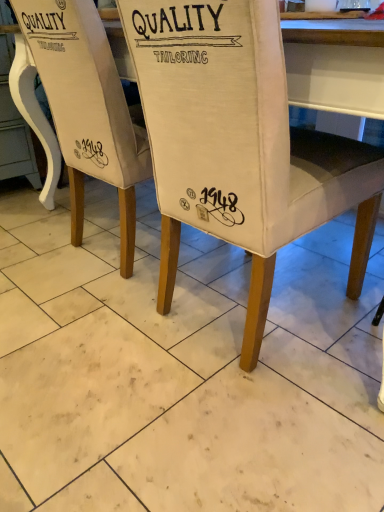
Question: Is white fabric chair at center, which is the first chair in right-to-left order, to the left or to the right of canvas chair at center, arranged as the 1th chair when viewed from the left, in the image?

Choices:
 (A) left
 (B) right

Answer: (B)

Question: Considering their positions, is white fabric chair at center, marked as the second chair in a left-to-right arrangement, located in front of or behind canvas chair at center, arranged as the 1th chair when viewed from the left?

Choices:
 (A) front
 (B) behind

Answer: (A)

Question: In terms of height, does white fabric chair at center, marked as the second chair in a left-to-right arrangement, look taller or shorter compared to canvas chair at center, arranged as the 1th chair when viewed from the left?

Choices:
 (A) short
 (B) tall

Answer: (A)

Question: Is canvas chair at center, arranged as the 1th chair when viewed from the left, in front of or behind white fabric chair at center, which is the first chair in right-to-left order, in the image?

Choices:
 (A) front
 (B) behind

Answer: (B)

Question: Considering the positions of canvas chair at center, arranged as the 1th chair when viewed from the left, and white fabric chair at center, which is the first chair in right-to-left order, in the image, is canvas chair at center, arranged as the 1th chair when viewed from the left, bigger or smaller than white fabric chair at center, which is the first chair in right-to-left order,?

Choices:
 (A) big
 (B) small

Answer: (B)

Question: In the image, is canvas chair at center, arranged as the second chair when viewed from the right, on the left side or the right side of white fabric chair at center, which is the first chair in right-to-left order?

Choices:
 (A) left
 (B) right

Answer: (A)

Question: Is point (89, 81) closer or farther from the camera than point (324, 133)?

Choices:
 (A) closer
 (B) farther

Answer: (A)